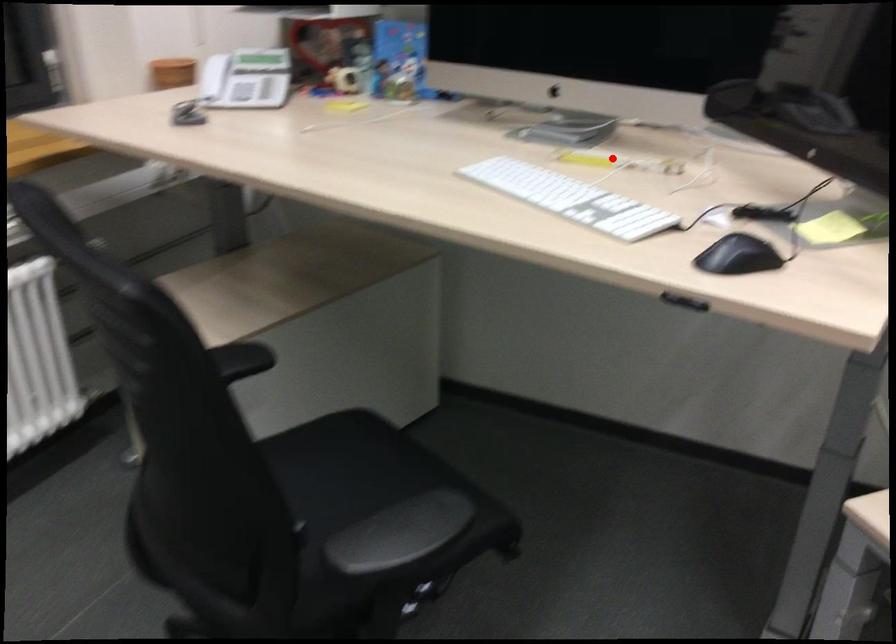
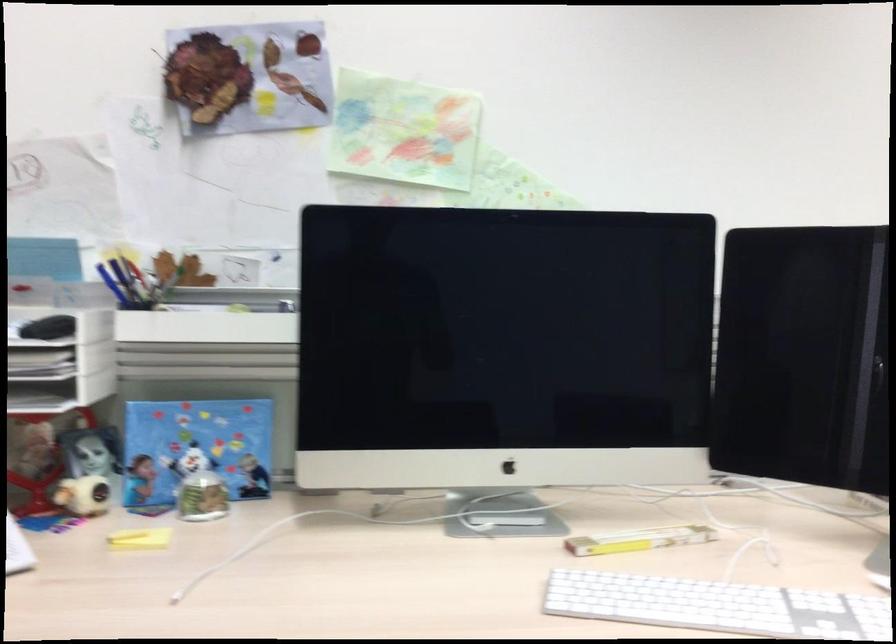
Question: I am providing you with two images of the same scene from different viewpoints. Given a red point in image1, look at the same physical point in image2. Is it:

Choices:
 (A) Closer to the viewpoint
 (B) Farther from the viewpoint

Answer: (A)